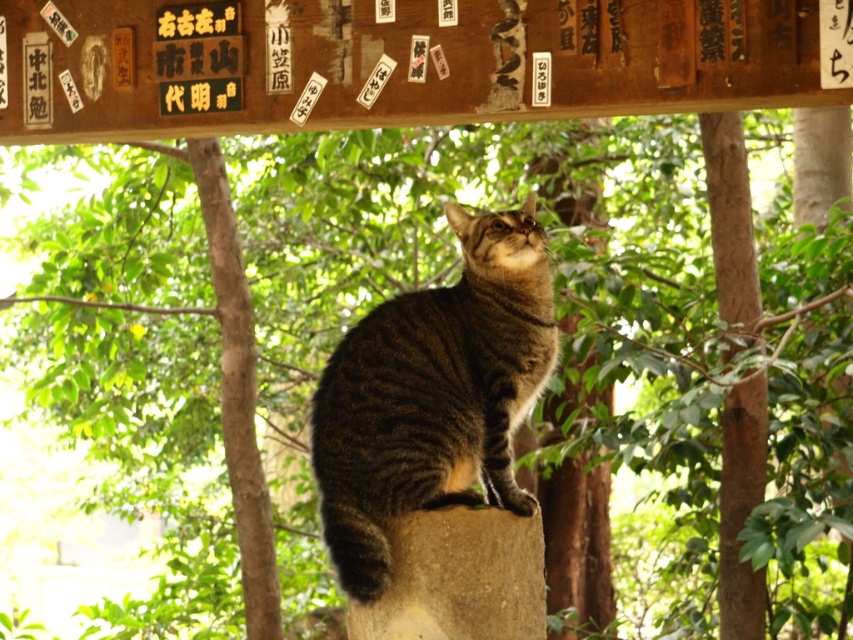
Can you confirm if tabby fur cat at center is shorter than brown rough stone at center?

In fact, tabby fur cat at center may be taller than brown rough stone at center.

Who is positioned more to the left, tabby fur cat at center or brown rough stone at center?

tabby fur cat at center

Image resolution: width=853 pixels, height=640 pixels. What do you see at coordinates (434, 394) in the screenshot?
I see `tabby fur cat at center` at bounding box center [434, 394].

Locate an element on the screen. Image resolution: width=853 pixels, height=640 pixels. tabby fur cat at center is located at coordinates (434, 394).